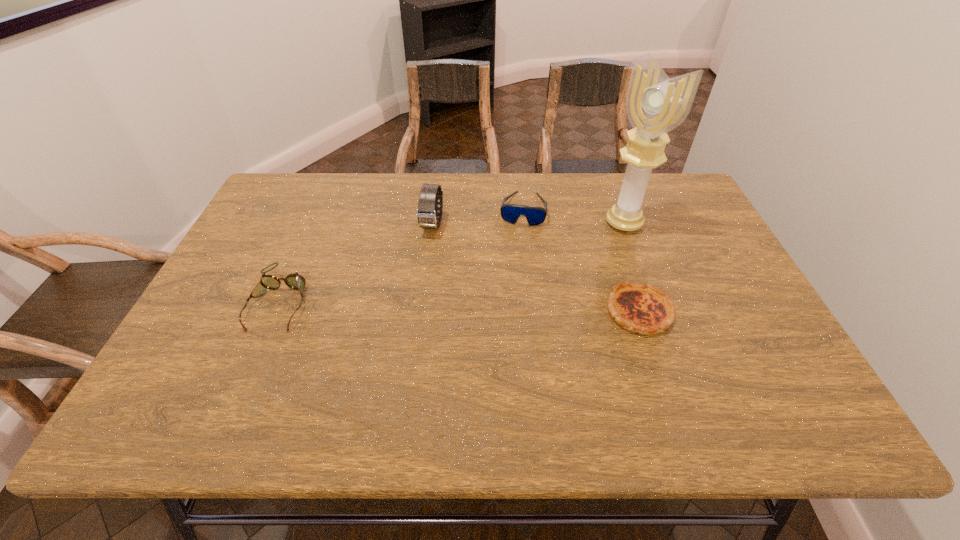
The image size is (960, 540). I want to click on vacant position located 0.250m on the face of the fourth shortest object, so click(x=410, y=305).

This screenshot has width=960, height=540. Identify the location of vacant space located on the face of the fourth shortest object. (426, 251).

Locate an element on the screen. vacant region located on the face of the fourth shortest object is located at coordinates (399, 337).

The width and height of the screenshot is (960, 540). Identify the location of vacant space located on the front-facing side of the tallest object. (589, 246).

You are a GUI agent. You are given a task and a screenshot of the screen. Output one action in this format:
    pyautogui.click(x=<x>, y=<y>)
    Task: Click on the free space located 0.280m on the front-facing side of the tallest object
    
    Given the screenshot: What is the action you would take?
    pyautogui.click(x=542, y=276)

I want to click on vacant region located on the front-facing side of the tallest object, so click(553, 270).

Locate an element on the screen. Image resolution: width=960 pixels, height=540 pixels. free space located 0.110m on the front-facing side of the sunglasses is located at coordinates (516, 252).

The image size is (960, 540). I want to click on vacant region located 0.200m on the front-facing side of the sunglasses, so click(513, 275).

Find the location of a particular element. vacant space located 0.100m on the front-facing side of the sunglasses is located at coordinates (517, 250).

Identify the location of watch that is at the far edge. (427, 212).